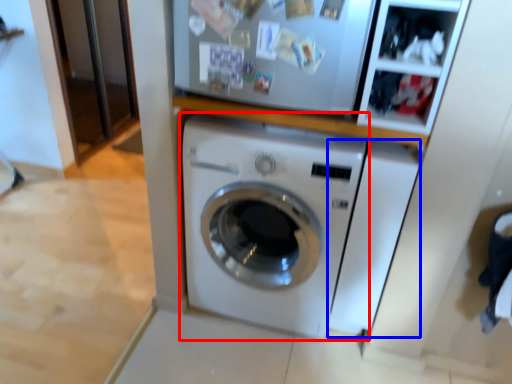
Question: Which object is further to the camera taking this photo, washing machine (highlighted by a red box) or washing machine (highlighted by a blue box)?

Choices:
 (A) washing machine
 (B) washing machine

Answer: (B)